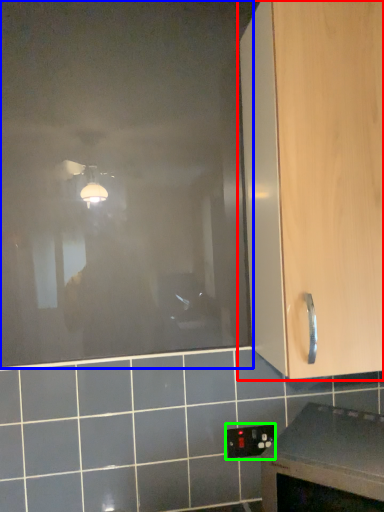
Question: Which is farther away from cabinetry (highlighted by a red box)? glass door (highlighted by a blue box) or electric outlet (highlighted by a green box)?

Choices:
 (A) glass door
 (B) electric outlet

Answer: (B)